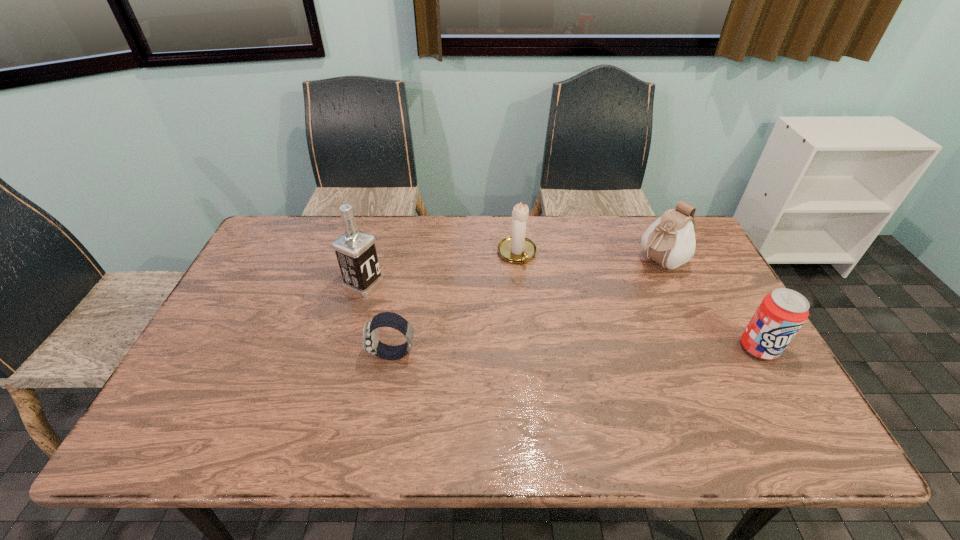
At what (x,y) coordinates should I click in order to perform the action: click on the shortest object. Please return your answer as a coordinate pair (x, y). Image resolution: width=960 pixels, height=540 pixels. Looking at the image, I should click on (371, 344).

You are a GUI agent. You are given a task and a screenshot of the screen. Output one action in this format:
    pyautogui.click(x=<x>, y=<y>)
    Task: Click on the second object from left to right
    
    Given the screenshot: What is the action you would take?
    pyautogui.click(x=371, y=344)

Where is `the rightmost object`? The width and height of the screenshot is (960, 540). the rightmost object is located at coordinates (781, 314).

You are a GUI agent. You are given a task and a screenshot of the screen. Output one action in this format:
    pyautogui.click(x=<x>, y=<y>)
    Task: Click on the fourth object from left to right
    The image size is (960, 540).
    Given the screenshot: What is the action you would take?
    pyautogui.click(x=670, y=241)

Where is `candle holder`? This screenshot has width=960, height=540. candle holder is located at coordinates (517, 248).

This screenshot has height=540, width=960. Find the location of `the leftmost object`. the leftmost object is located at coordinates (355, 250).

The height and width of the screenshot is (540, 960). I want to click on the tallest object, so click(355, 250).

I want to click on vacant area located 0.360m on the face of the fourth object from right to left, so click(229, 355).

Where is `free spot located on the face of the fourth object from right to left`? free spot located on the face of the fourth object from right to left is located at coordinates (327, 355).

The image size is (960, 540). I want to click on vacant position located on the face of the fourth object from right to left, so click(292, 355).